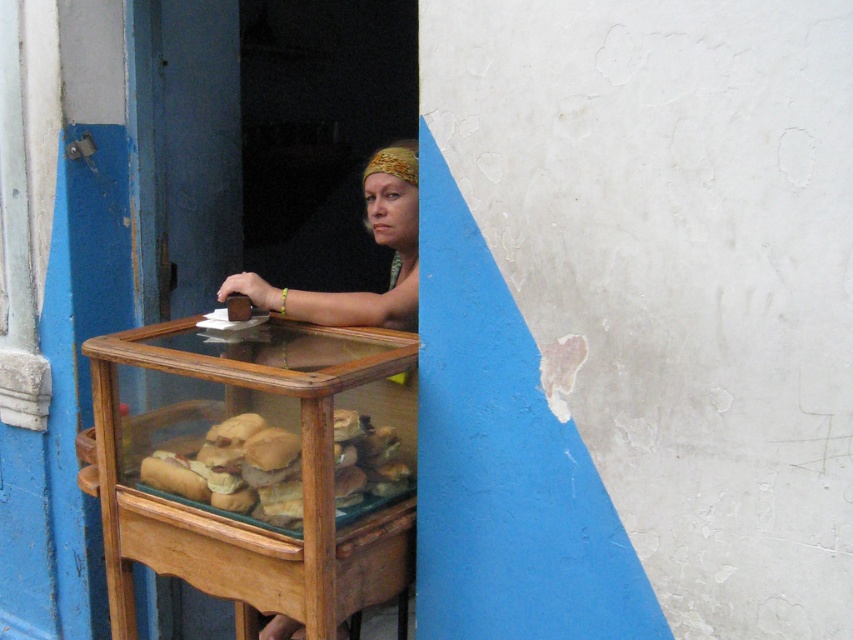
You are a customer at a bakery and see the golden brown bread at center and the matte brown hair at center. Which object is closer to you?

The golden brown bread at center is closer to you because it is in front of the matte brown hair at center.

You are standing in front of the glass display case with a wooden frame. You notice two points marked on the display case. One is at coordinate point (229,490) and the other is at point (416,170). Which point is closer to you?

Point (229,490) is closer to the viewer than point (416,170).

You are a delivery person who needs to place a package between the golden brown bread at center and the matte brown hair at center. Can you fit the package if it requires 12 inches of space?

The distance between the golden brown bread at center and the matte brown hair at center is 13.28 inches, so yes, the package requiring 12 inches of space can fit between them.